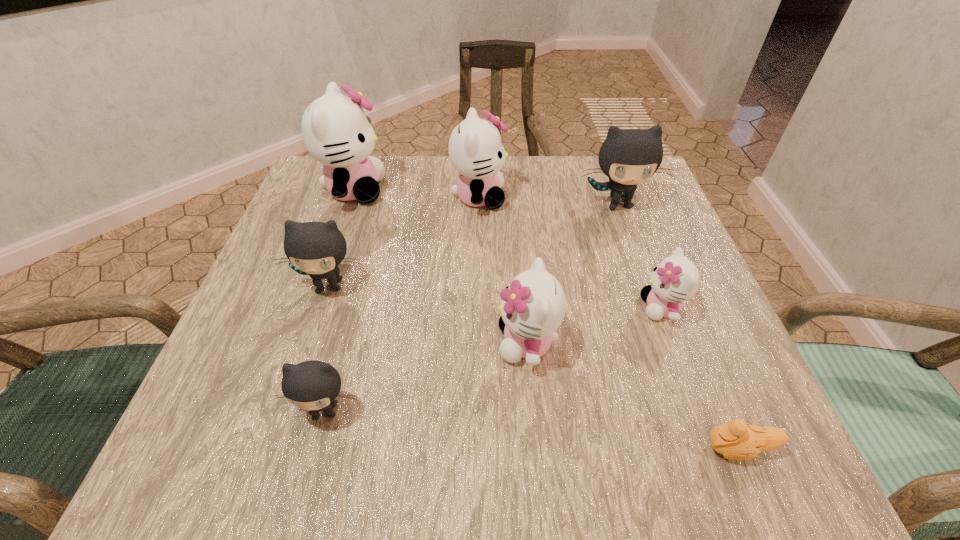
The width and height of the screenshot is (960, 540). Identify the location of object located at the far right corner. (628, 157).

This screenshot has width=960, height=540. I want to click on object that is positioned at the near right corner, so click(x=737, y=440).

The width and height of the screenshot is (960, 540). What are the coordinates of `vacant space at the far edge` in the screenshot? It's located at (436, 176).

Locate an element on the screen. vacant region at the near edge of the desktop is located at coordinates (612, 412).

I want to click on blank space at the left edge, so click(255, 318).

This screenshot has height=540, width=960. What are the coordinates of `vacant region at the right edge` in the screenshot? It's located at (709, 347).

The height and width of the screenshot is (540, 960). In the image, there is a desktop. Identify the location of free region at the far left corner. (322, 193).

In the image, there is a desktop. Identify the location of free space at the near left corner. (304, 417).

The width and height of the screenshot is (960, 540). What are the coordinates of `vacant space at the near right corner of the desktop` in the screenshot? It's located at (720, 418).

The width and height of the screenshot is (960, 540). I want to click on unoccupied position between the biggest gray kitten and the shortest object, so click(678, 326).